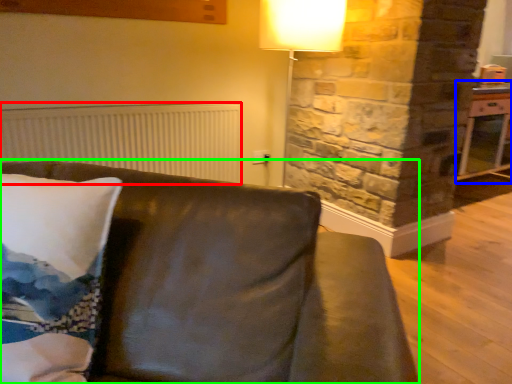
Question: Which object is positioned closest to radiator (highlighted by a red box)? Select from table (highlighted by a blue box) and studio couch (highlighted by a green box).

Choices:
 (A) table
 (B) studio couch

Answer: (B)